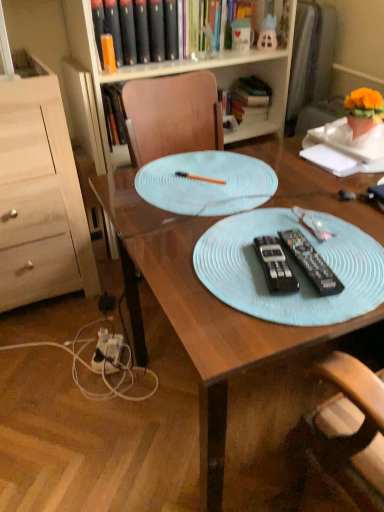
The height and width of the screenshot is (512, 384). Find the location of `vacant region in front of orange plastic pen at center`. vacant region in front of orange plastic pen at center is located at coordinates pyautogui.click(x=205, y=218).